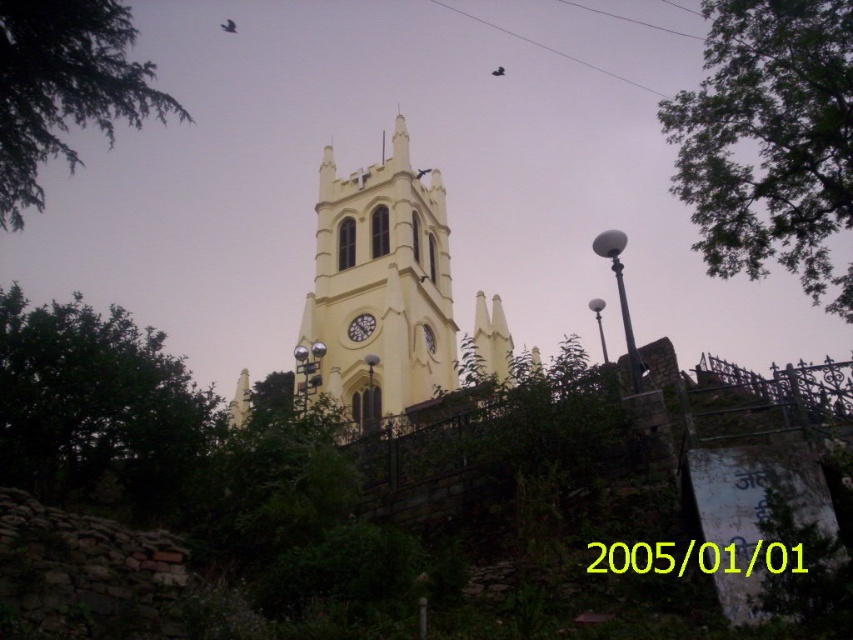
Question: Is green leafy tree at upper right below green leafy branch at upper left?

Choices:
 (A) yes
 (B) no

Answer: (A)

Question: Among these points, which one is farthest from the camera?

Choices:
 (A) (352, 408)
 (B) (705, 243)
 (C) (347, 332)

Answer: (C)

Question: Does yellow matte tower at center come in front of matte yellow clock at center?

Choices:
 (A) no
 (B) yes

Answer: (B)

Question: Which of the following is the closest to the observer?

Choices:
 (A) matte yellow clock at center
 (B) green leafy branch at upper left
 (C) yellow matte tower at center
 (D) green leafy tree at left

Answer: (D)

Question: Is yellow matte tower at center to the left of matte yellow clock at center from the viewer's perspective?

Choices:
 (A) no
 (B) yes

Answer: (A)

Question: Estimate the real-world distances between objects in this image. Which object is closer to the green leafy branch at upper left?

Choices:
 (A) green leafy tree at left
 (B) green leafy tree at upper right
 (C) matte yellow clock at center

Answer: (A)